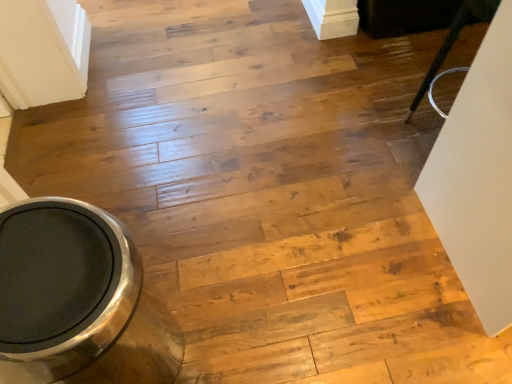
Locate an element on the screen. free space to the back side of black glossy chair at upper right is located at coordinates (400, 82).